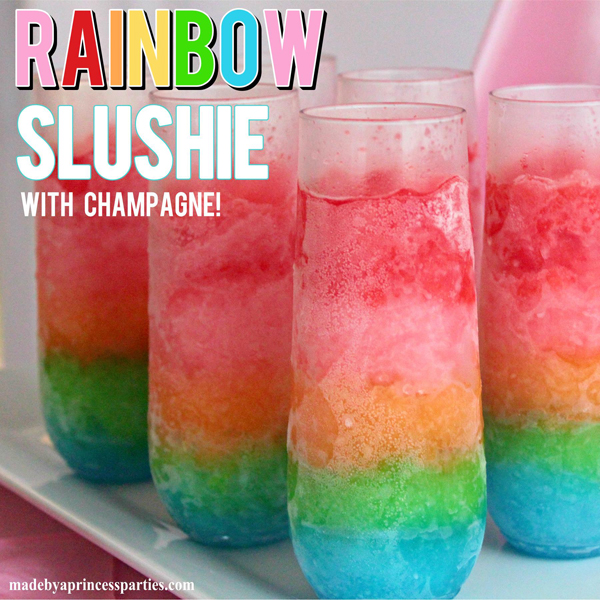
Locate an element on the screen. pink table cover is located at coordinates (x=32, y=552).